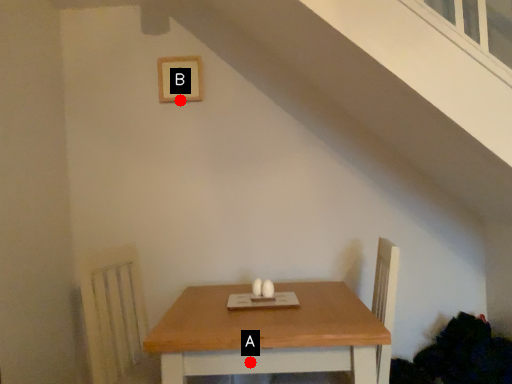
Question: Two points are circled on the image, labeled by A and B beside each circle. Among these points, which one is nearest to the camera?

Choices:
 (A) A is closer
 (B) B is closer

Answer: (A)